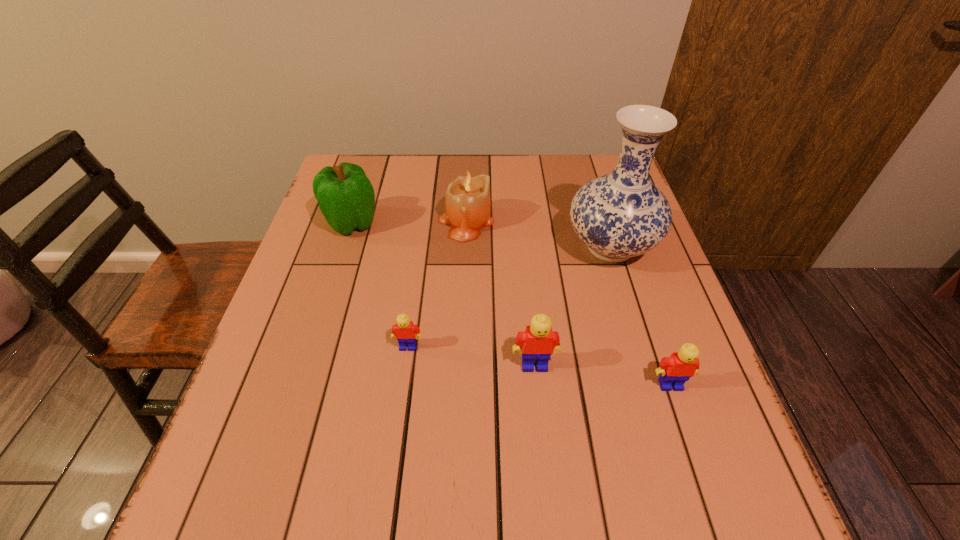
At what (x,y) coordinates should I click in order to perform the action: click on blank space at the right edge. Please return your answer as a coordinate pair (x, y). This screenshot has width=960, height=540. Looking at the image, I should click on (711, 393).

This screenshot has width=960, height=540. I want to click on vacant space at the far right corner of the desktop, so click(x=614, y=155).

Where is `empty location between the vase and the third object from left to right`? The width and height of the screenshot is (960, 540). empty location between the vase and the third object from left to right is located at coordinates (539, 235).

Locate an element on the screen. vacant area between the shortest Lego and the second nearest object is located at coordinates (471, 356).

Where is `free space between the candle and the farthest Lego`? This screenshot has width=960, height=540. free space between the candle and the farthest Lego is located at coordinates (437, 284).

Where is `free space between the candle and the nearest object`? This screenshot has width=960, height=540. free space between the candle and the nearest object is located at coordinates (568, 303).

Where is `vacant point located between the shortest Lego and the bell pepper`? vacant point located between the shortest Lego and the bell pepper is located at coordinates (380, 285).

Where is `blank region between the bell pepper and the second Lego from left to right`? blank region between the bell pepper and the second Lego from left to right is located at coordinates (444, 294).

This screenshot has width=960, height=540. In order to click on free point between the leftmost object and the candle in this screenshot , I will do `click(409, 222)`.

The image size is (960, 540). I want to click on vacant space that's between the tallest object and the fourth farthest object, so click(x=510, y=297).